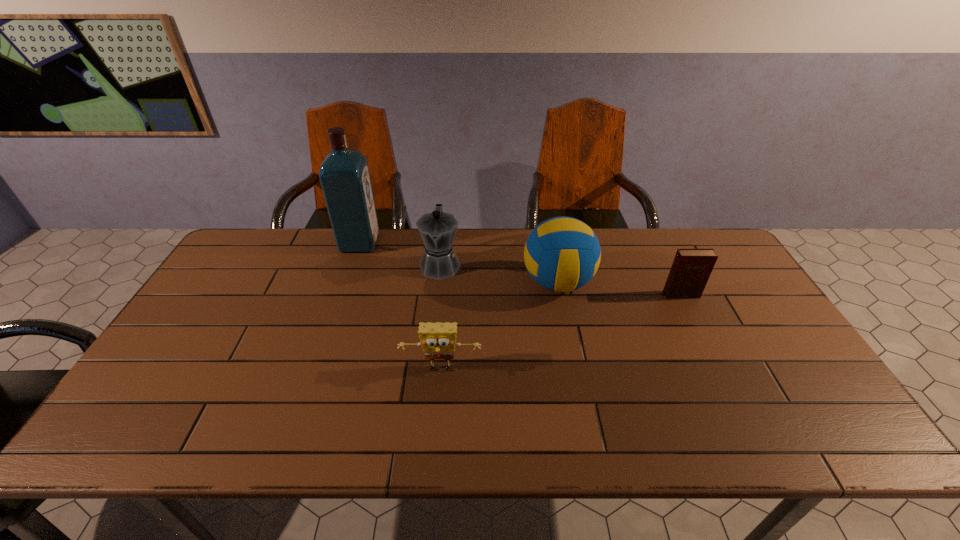
Locate an element on the screen. liquor is located at coordinates (344, 175).

Locate an element on the screen. The image size is (960, 540). the leftmost object is located at coordinates (344, 175).

You are a GUI agent. You are given a task and a screenshot of the screen. Output one action in this format:
    pyautogui.click(x=<x>, y=<y>)
    Task: Click on the fourth object from left to right
    
    Given the screenshot: What is the action you would take?
    pyautogui.click(x=562, y=254)

Identify the location of coffeepot. point(437,229).

You are a GUI agent. You are given a task and a screenshot of the screen. Output one action in this format:
    pyautogui.click(x=<x>, y=<y>)
    Task: Click on the diary
    The width and height of the screenshot is (960, 540).
    Given the screenshot: What is the action you would take?
    pyautogui.click(x=691, y=269)

At what (x,y) coordinates should I click in order to perform the action: click on sponge. Please return your answer as a coordinate pair (x, y). This screenshot has width=960, height=540. Looking at the image, I should click on (438, 340).

Locate an element on the screen. The image size is (960, 540). vacant space located 0.070m on the flat label side of the tallest object is located at coordinates (398, 243).

Find the location of a particular element. vacant position located on the left of the volleyball is located at coordinates (447, 282).

The image size is (960, 540). In order to click on free space located at the spout of the coffeepot in this screenshot , I will do `click(437, 296)`.

Where is `free space located on the front cover of the diary`? free space located on the front cover of the diary is located at coordinates (717, 366).